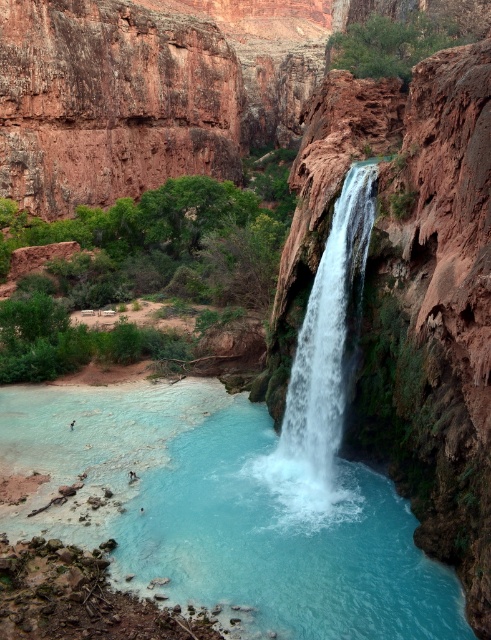
Question: Is clear blue water at center to the right of white frothy water at center from the viewer's perspective?

Choices:
 (A) yes
 (B) no

Answer: (B)

Question: Is clear blue water at center in front of white frothy water at center?

Choices:
 (A) no
 (B) yes

Answer: (B)

Question: Which point appears closest to the camera in this image?

Choices:
 (A) (327, 241)
 (B) (125, 465)

Answer: (B)

Question: Is clear blue water at center wider than white frothy water at center?

Choices:
 (A) yes
 (B) no

Answer: (A)